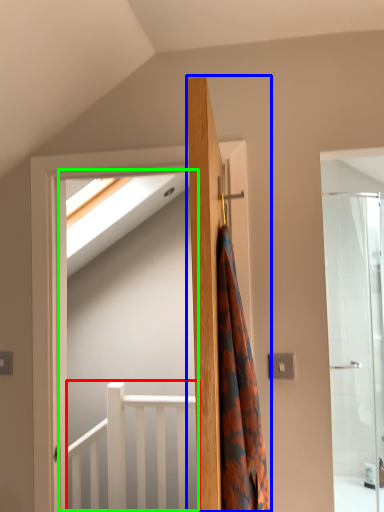
Question: Based on their relative distances, which object is nearer to balustrade (highlighted by a red box)? Choose from door (highlighted by a blue box) and screen door (highlighted by a green box).

Choices:
 (A) door
 (B) screen door

Answer: (B)